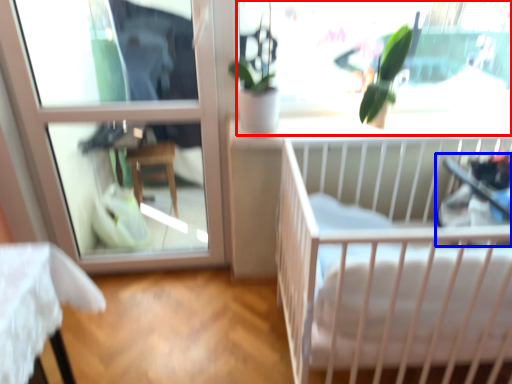
Question: Which point is closer to the camera, window screen (highlighted by a red box) or baby carriage (highlighted by a blue box)?

Choices:
 (A) window screen
 (B) baby carriage

Answer: (B)